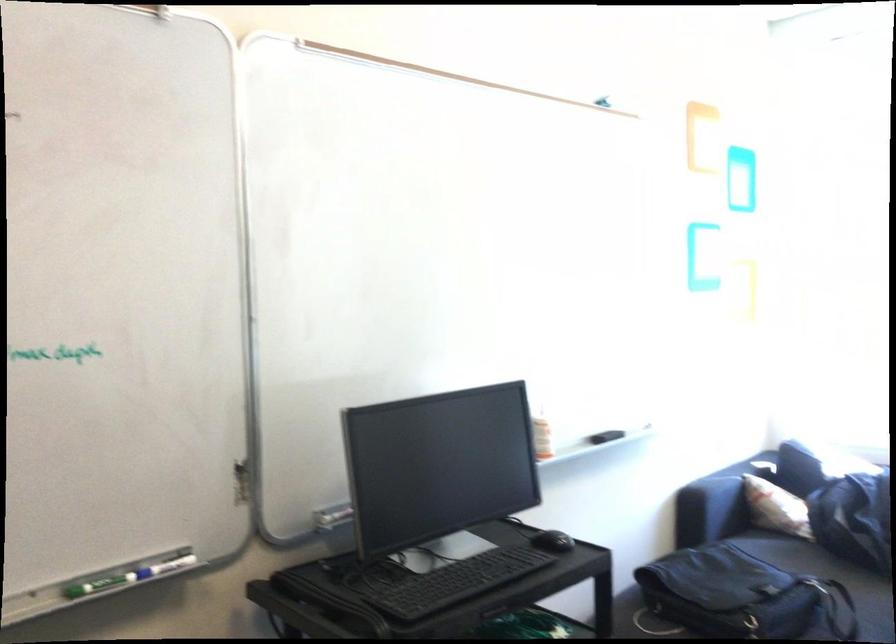
Which object does [165,567] point to?

This point indicates the blue dry-erase marker.